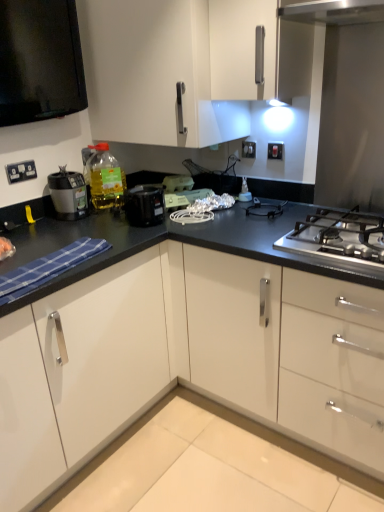
Question: From the image's perspective, is white plastic toaster at center, acting as the first appliance starting from the left, above or below stainless steel gas stove at center right?

Choices:
 (A) above
 (B) below

Answer: (A)

Question: Choose the correct answer: Is white plastic toaster at center, acting as the first appliance starting from the left, inside stainless steel gas stove at center right or outside it?

Choices:
 (A) inside
 (B) outside

Answer: (B)

Question: Based on their relative distances, which object is nearer to the black plastic coffee maker at upper left, which is counted as the 2th kitchen appliance, starting from the left?

Choices:
 (A) white glossy cabinet at upper center
 (B) white plastic electric outlet at upper center, the 1th electric outlet when ordered from top to bottom
 (C) translucent plastic bottle at upper left
 (D) matte black blender at left, placed as the second kitchen appliance when sorted from right to left
 (E) white plastic electrical outlet at upper left, acting as the third electric outlet starting from the top

Answer: (C)

Question: Estimate the real-world distances between objects in this image. Which object is farther from the clear plastic spray bottle at center, the 3th appliance when ordered from left to right?

Choices:
 (A) white plastic electrical outlet at upper left, the 3th electric outlet in the back-to-front sequence
 (B) white glossy cabinet at upper center
 (C) matte black blender at left, the 1th kitchen appliance when ordered from left to right
 (D) white plastic electric outlet at upper center, acting as the 1th electric outlet starting from the back
 (E) stainless steel gas stove at center right

Answer: (A)